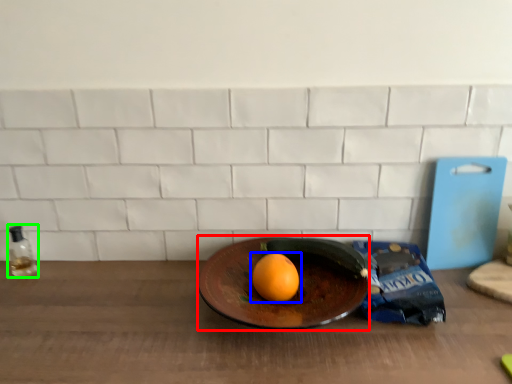
Question: Based on their relative distances, which object is farther from plate (highlighted by a red box)? Choose from grapefruit (highlighted by a blue box) and bottle (highlighted by a green box).

Choices:
 (A) grapefruit
 (B) bottle

Answer: (B)